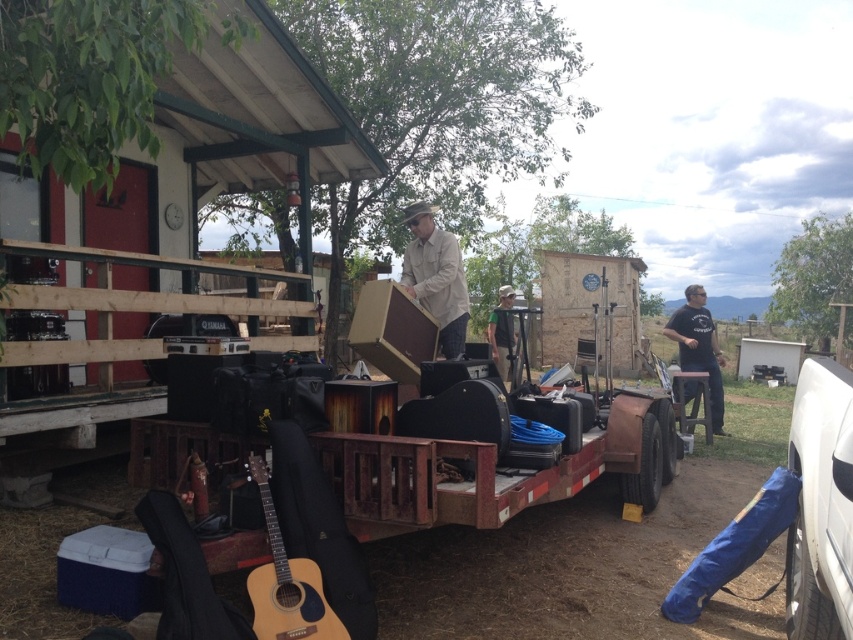
Question: Which object is positioned farthest from the wooden hut at center?

Choices:
 (A) natural wood acoustic guitar at lower left
 (B) wooden stool at center
 (C) wooden porch at upper left

Answer: (A)

Question: Can you confirm if wooden hut at center is wider than tan canvas guitar case at center?

Choices:
 (A) yes
 (B) no

Answer: (A)

Question: Which of the following is the farthest from the observer?

Choices:
 (A) (300, 611)
 (B) (589, 317)
 (C) (0, 358)

Answer: (B)

Question: Which is farther from the wooden porch at upper left?

Choices:
 (A) black cotton shirt at right
 (B) green fabric shirt at center

Answer: (A)

Question: Can you confirm if wooden hut at center is positioned above green fabric shirt at center?

Choices:
 (A) no
 (B) yes

Answer: (B)

Question: Can you confirm if natural wood acoustic guitar at lower left is positioned below black cotton shirt at right?

Choices:
 (A) yes
 (B) no

Answer: (A)